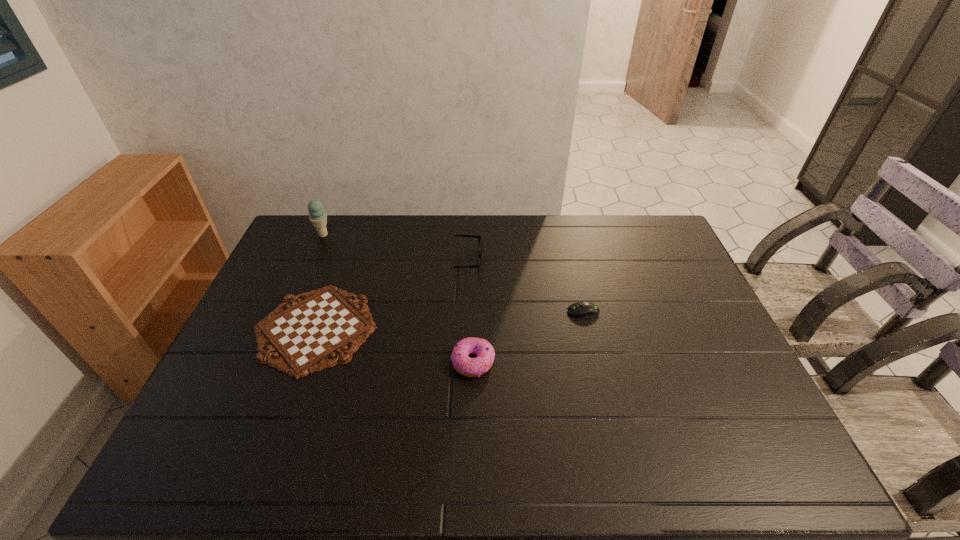
You are a GUI agent. You are given a task and a screenshot of the screen. Output one action in this format:
    pyautogui.click(x=<x>, y=<y>)
    Task: Click on the unoccupied position between the spectacles and the shortest object
    
    Given the screenshot: What is the action you would take?
    pyautogui.click(x=393, y=295)

Locate an element on the screen. The image size is (960, 540). vacant space that's between the chessboard and the ice cream is located at coordinates (320, 281).

You are a GUI agent. You are given a task and a screenshot of the screen. Output one action in this format:
    pyautogui.click(x=<x>, y=<y>)
    Task: Click on the unoccupied position between the spectacles and the shortest object
    
    Given the screenshot: What is the action you would take?
    pyautogui.click(x=393, y=295)

Find the location of `unoccupied area between the fourth tallest object and the chessboard`. unoccupied area between the fourth tallest object and the chessboard is located at coordinates (449, 320).

Where is `free area in between the ice cream and the shortest object`? The image size is (960, 540). free area in between the ice cream and the shortest object is located at coordinates (320, 281).

Locate an element on the screen. object identified as the closest to the doughnut is located at coordinates (304, 335).

Locate which object is the third closest to the second farthest object. Please provide its 2D coordinates. Your answer should be formatted as a tuple, i.e. [(x, y)], where the tuple contains the x and y coordinates of a point satisfying the conditions above.

[(580, 309)]

This screenshot has width=960, height=540. Find the location of `free point that satisfies the following two spatial constraints: 1. on the back side of the third tallest object; 2. on the front-facing side of the second farthest object`. free point that satisfies the following two spatial constraints: 1. on the back side of the third tallest object; 2. on the front-facing side of the second farthest object is located at coordinates (474, 262).

Image resolution: width=960 pixels, height=540 pixels. I want to click on free space that satisfies the following two spatial constraints: 1. on the front side of the tallest object; 2. on the right side of the third shortest object, so click(268, 361).